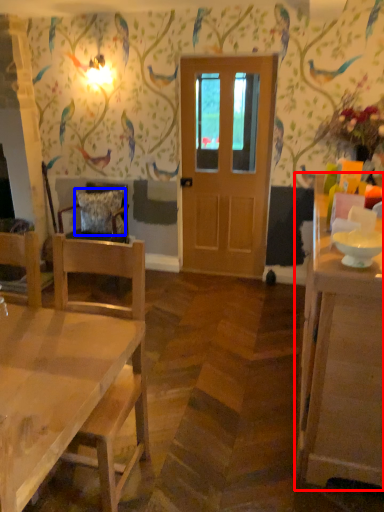
Question: Among these objects, which one is farthest to the camera, cabinetry (highlighted by a red box) or pillow (highlighted by a blue box)?

Choices:
 (A) cabinetry
 (B) pillow

Answer: (B)